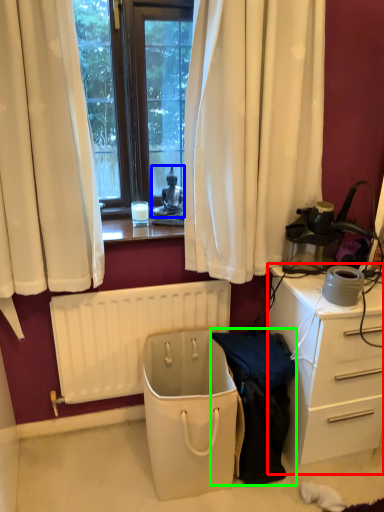
Question: Which object is the closest to the desk (highlighted by a red box)? Choose among these: person (highlighted by a blue box) or clothing (highlighted by a green box).

Choices:
 (A) person
 (B) clothing

Answer: (B)